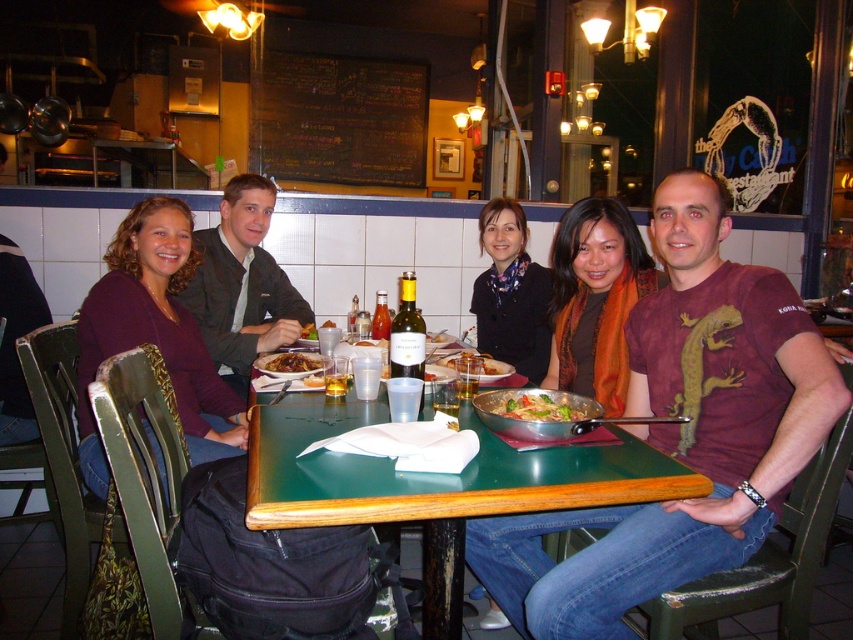
Which of these two, maroon t-shirt at center or green leafy vegetables at center, stands taller?

maroon t-shirt at center is taller.

Can you confirm if maroon t-shirt at center is smaller than green leafy vegetables at center?

No, maroon t-shirt at center is not smaller than green leafy vegetables at center.

Between point (691, 170) and point (544, 412), which one is positioned in front?

Point (544, 412)

I want to click on maroon t-shirt at center, so click(682, 433).

Does orange scarf at center appear on the left side of translucent glass bottle at table center?

Incorrect, orange scarf at center is not on the left side of translucent glass bottle at table center.

Image resolution: width=853 pixels, height=640 pixels. In order to click on orange scarf at center in this screenshot , I will do pos(595,298).

Between maroon t-shirt at center and metallic silver pan at center, which one has more height?

maroon t-shirt at center is taller.

Is maroon t-shirt at center closer to camera compared to metallic silver pan at center?

Yes, it is.

Does point (665, 211) come closer to viewer compared to point (581, 406)?

No, (665, 211) is further to viewer.

I want to click on maroon t-shirt at center, so click(x=682, y=433).